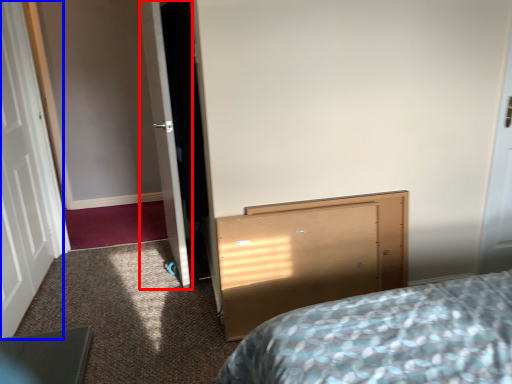
Question: Which object is further to the camera taking this photo, door (highlighted by a red box) or door (highlighted by a blue box)?

Choices:
 (A) door
 (B) door

Answer: (A)